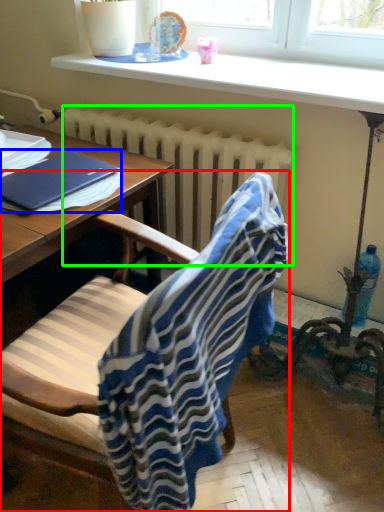
Question: Considering the real-world distances, which object is farthest from chair (highlighted by a red box)? notebook (highlighted by a blue box) or radiator (highlighted by a green box)?

Choices:
 (A) notebook
 (B) radiator

Answer: (B)